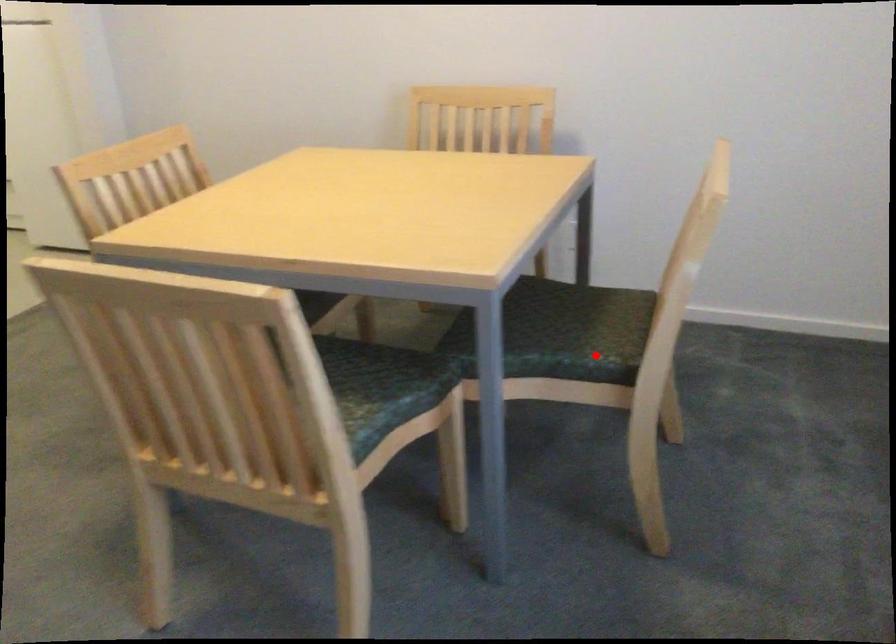
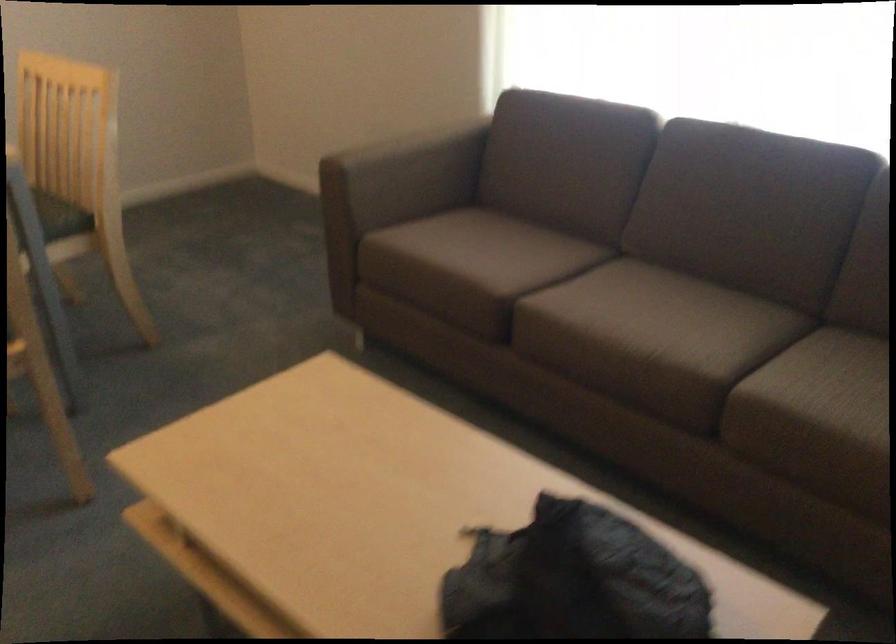
Where in the second image is the point corresponding to the highlighted location from the first image?

(61, 216)